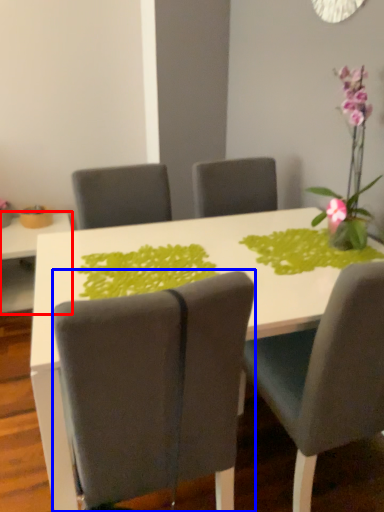
Question: Among these objects, which one is nearest to the camera, table (highlighted by a red box) or chair (highlighted by a blue box)?

Choices:
 (A) table
 (B) chair

Answer: (B)